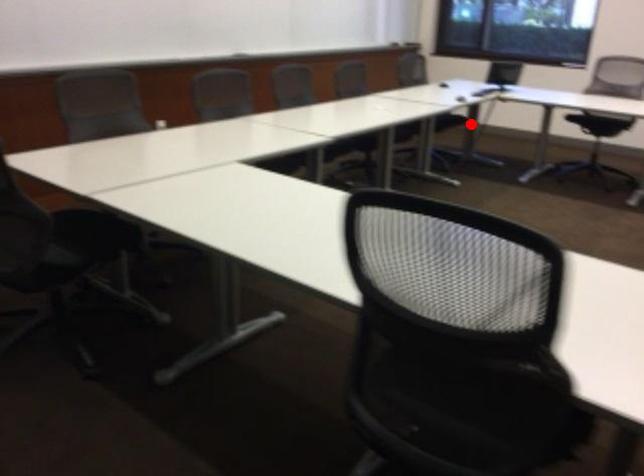
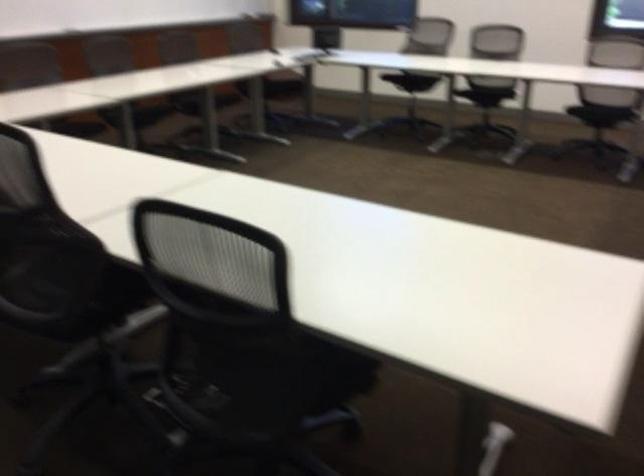
The point at the highlighted location is marked in the first image. Where is the corresponding point in the second image?

(277, 85)